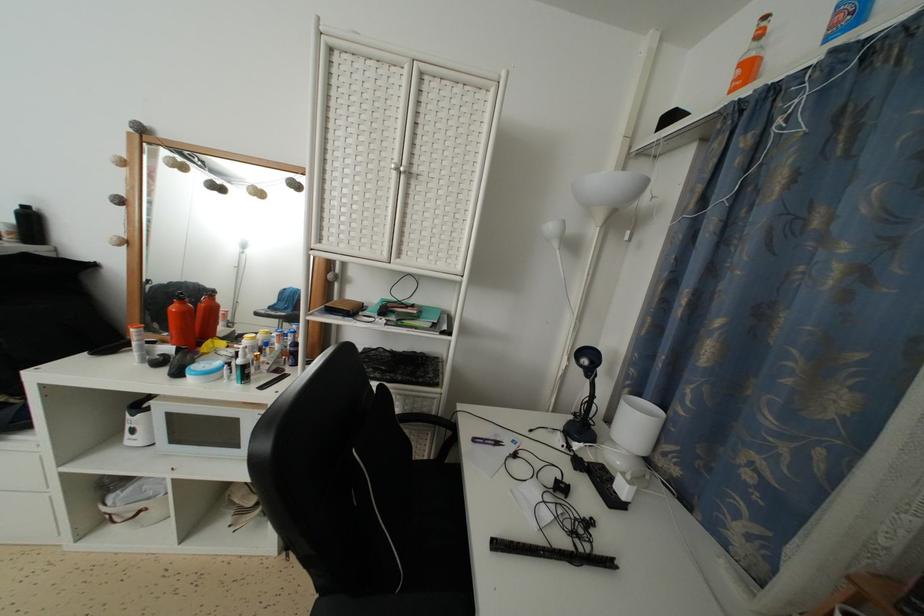
Find where to press the power strip button. Please return your answer as a coordinate pair (x, y).

(514, 440)